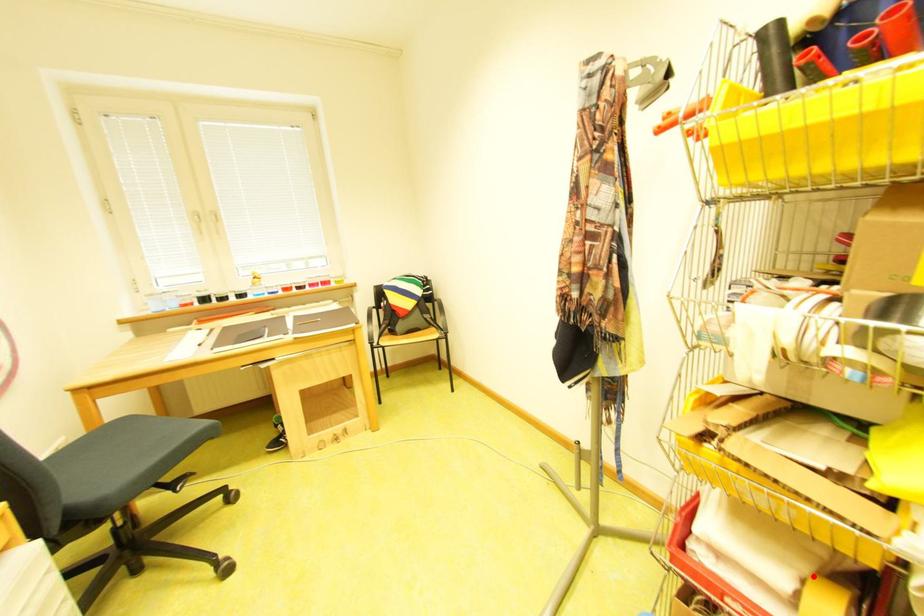
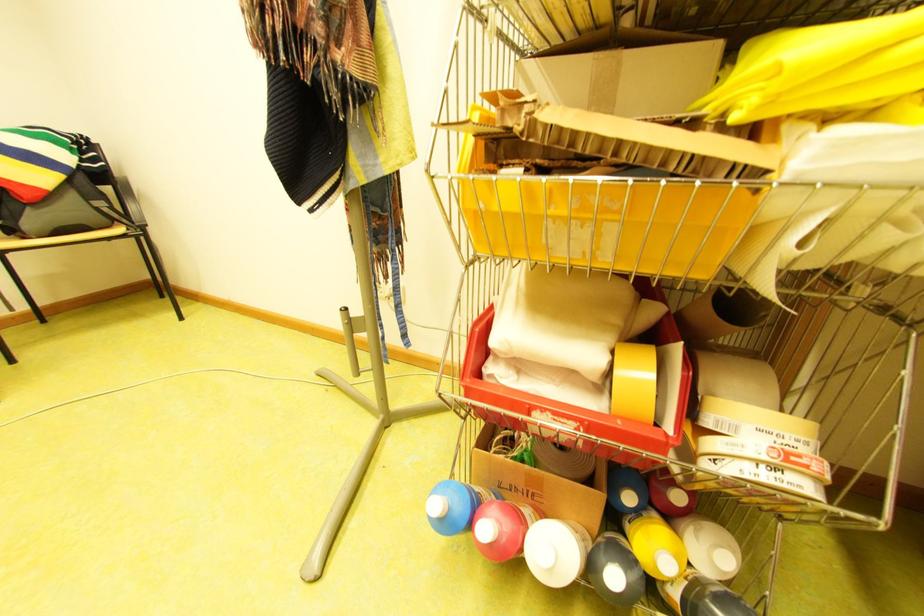
Question: I am providing you with two images of the same scene from different viewpoints. Given a red point in image1, look at the same physical point in image2. Is it:

Choices:
 (A) Closer to the viewpoint
 (B) Farther from the viewpoint

Answer: (B)